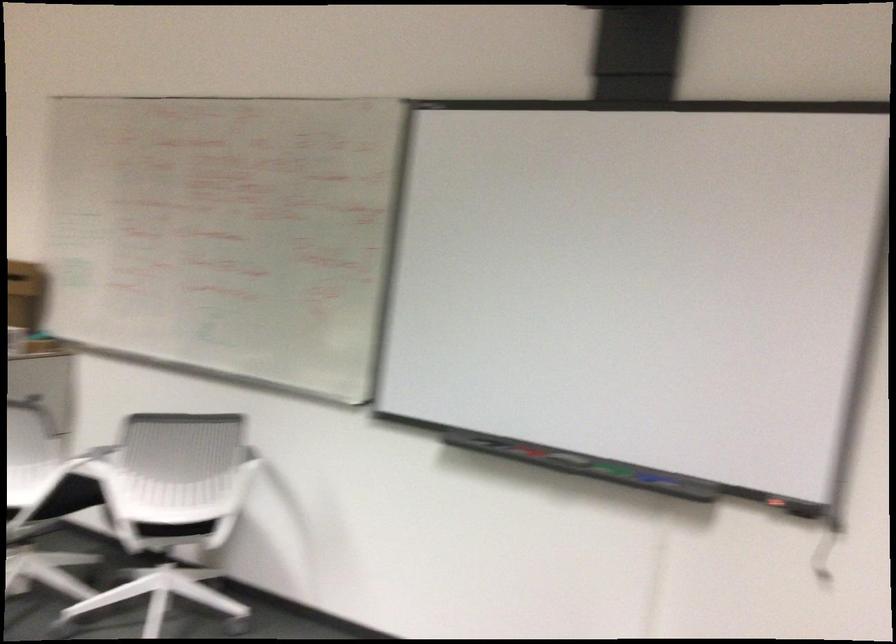
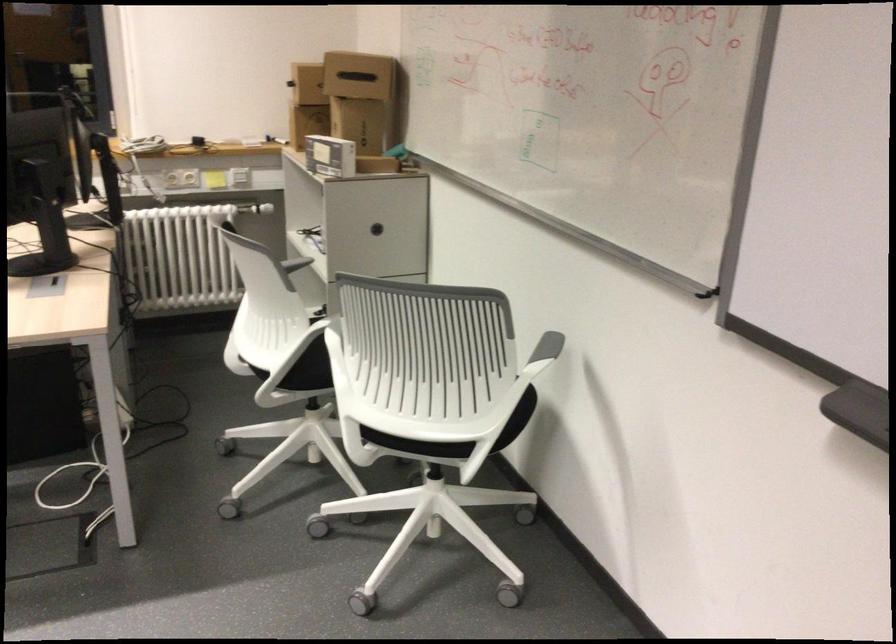
Locate, in the second image, the point that corresponds to pixel 437 439 in the first image.

(858, 411)